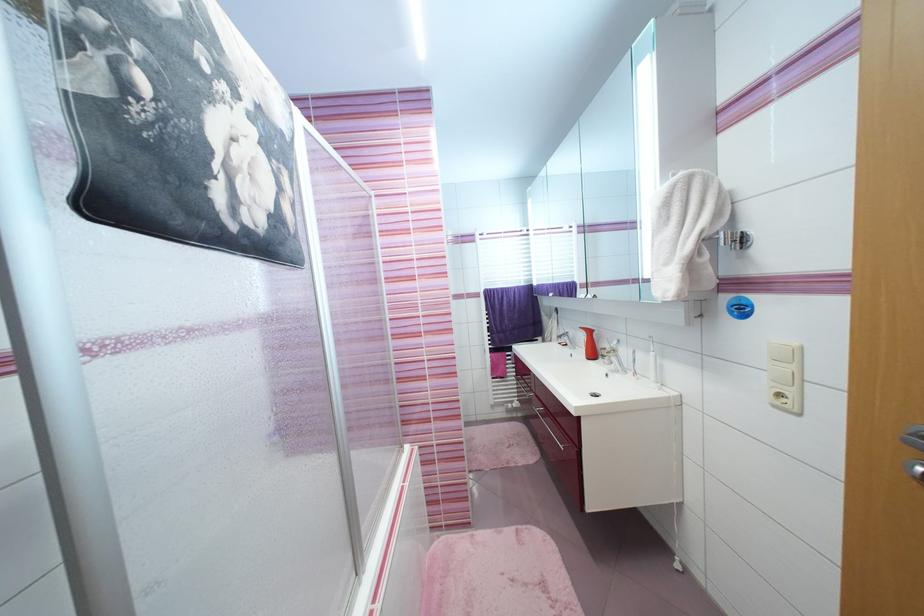
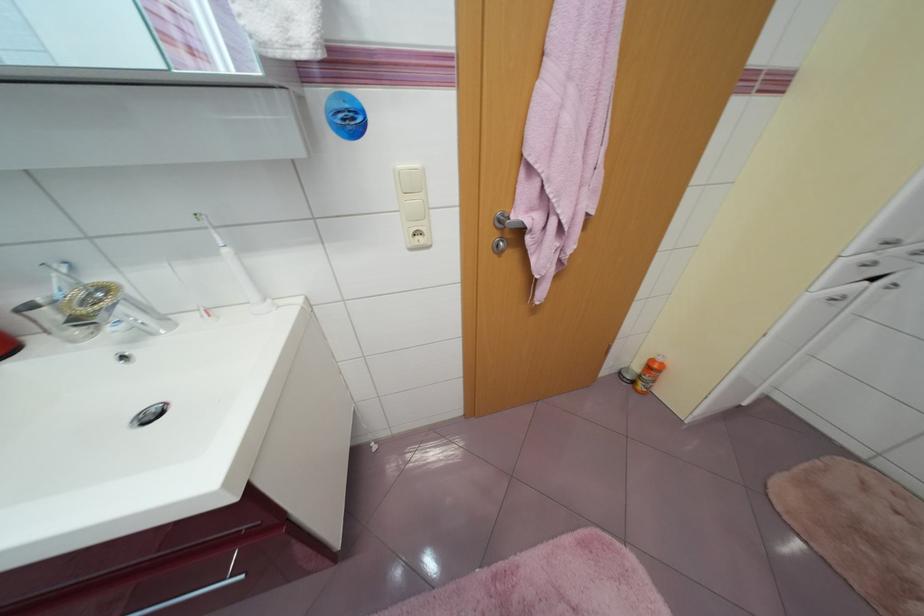
The first image is from the beginning of the video and the second image is from the end. How did the camera likely rotate when shooting the video?

The rotation direction of the camera is right-down.